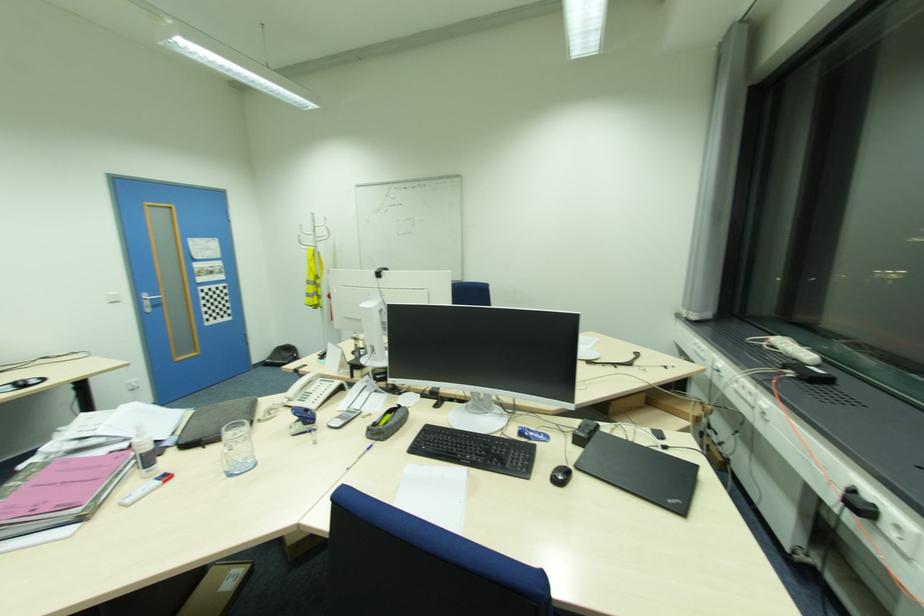
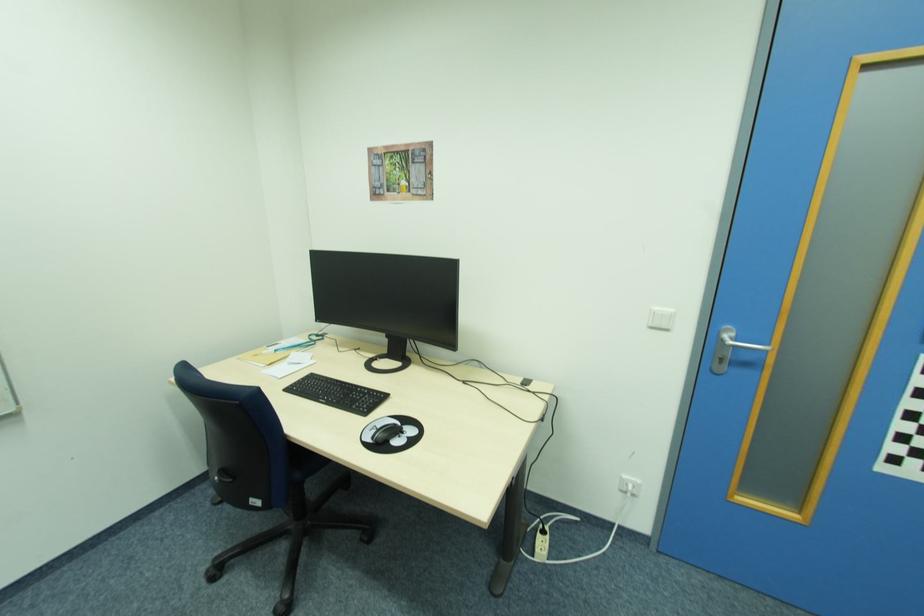
Where in the second image is the point corresponding to pixel 122 302 from the first image?

(670, 329)